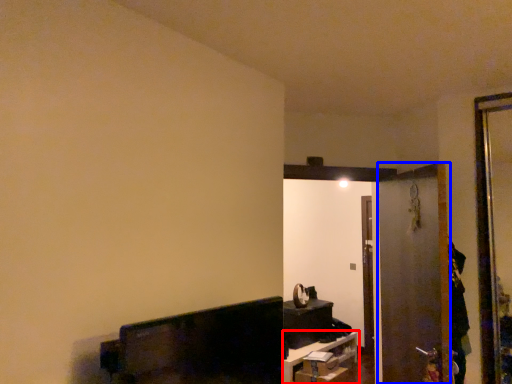
Question: Which object appears farthest to the camera in this image, furniture (highlighted by a red box) or screen door (highlighted by a blue box)?

Choices:
 (A) furniture
 (B) screen door

Answer: (A)